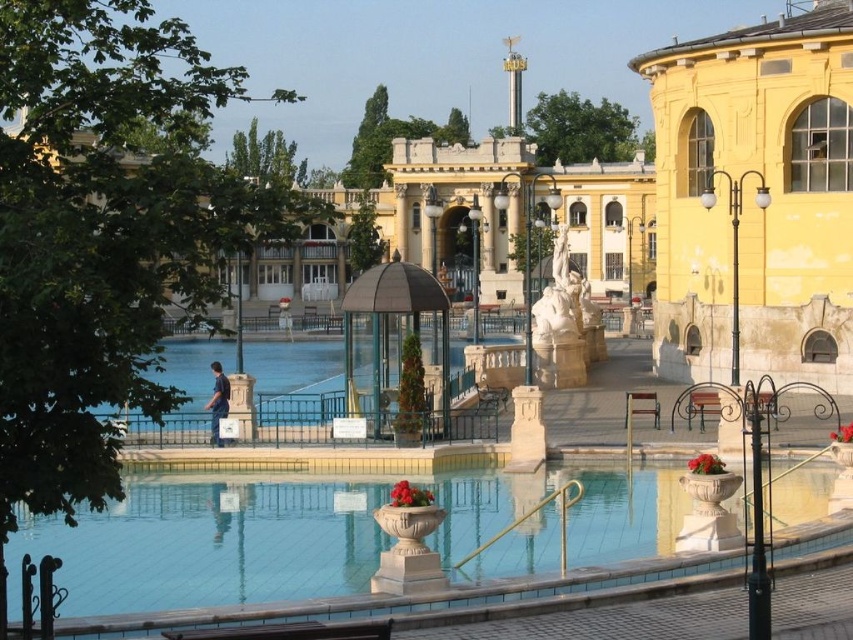
You are standing in the courtyard of the yellow painted stone building at right and want to reach the clear glass water at center. Which direction should you head towards?

You should head towards the left because the yellow painted stone building at right is to the right of clear glass water at center, meaning the clear glass water at center is to the left of the building.

You are a visitor standing in front of the ornate yellow building. You see the white marble statue at center and the brown wooden bench at center. Which object is taller?

Answer: The white marble statue at center is taller than the brown wooden bench at center.

You are standing in front of the large yellow building and want to take a photo of both the smooth concrete pool at center and the white marble statue at center. Which object should you point your camera towards first to ensure both are in the frame?

You should point your camera towards the white marble statue at center first because it is above the smooth concrete pool at center, so capturing it first ensures both are in the frame.